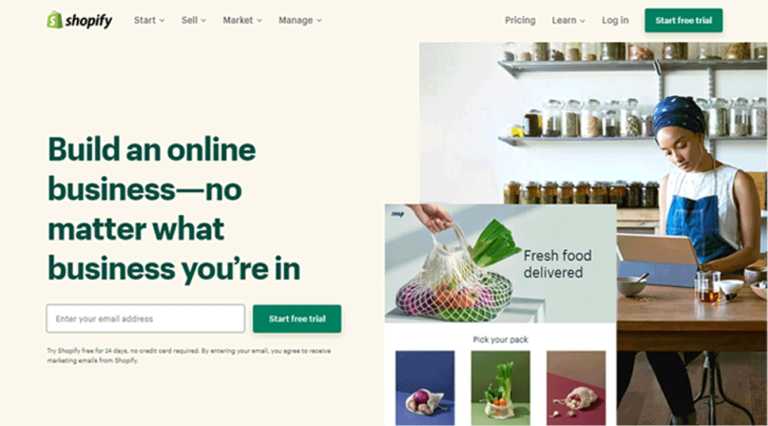
Identify the location of bowl. Image resolution: width=768 pixels, height=426 pixels. (634, 285).